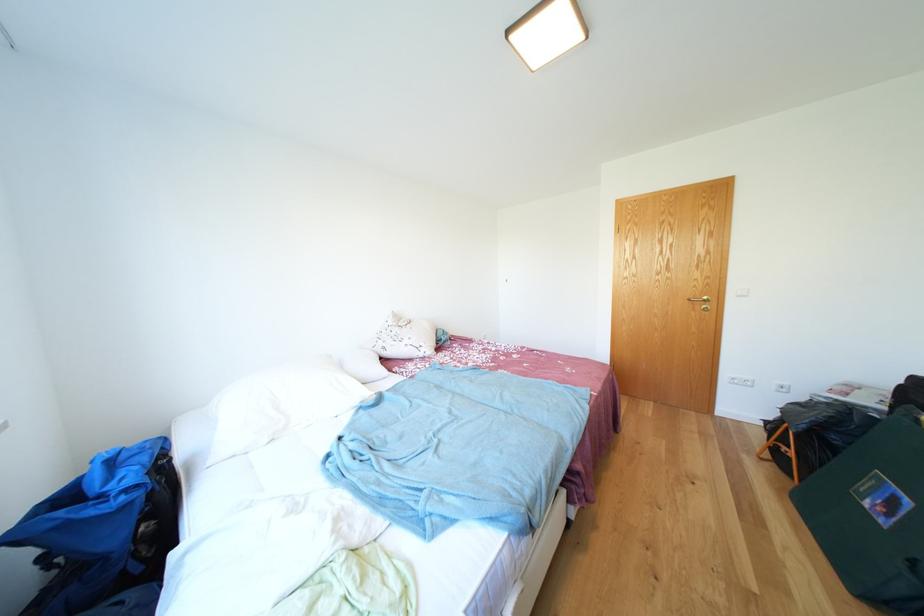
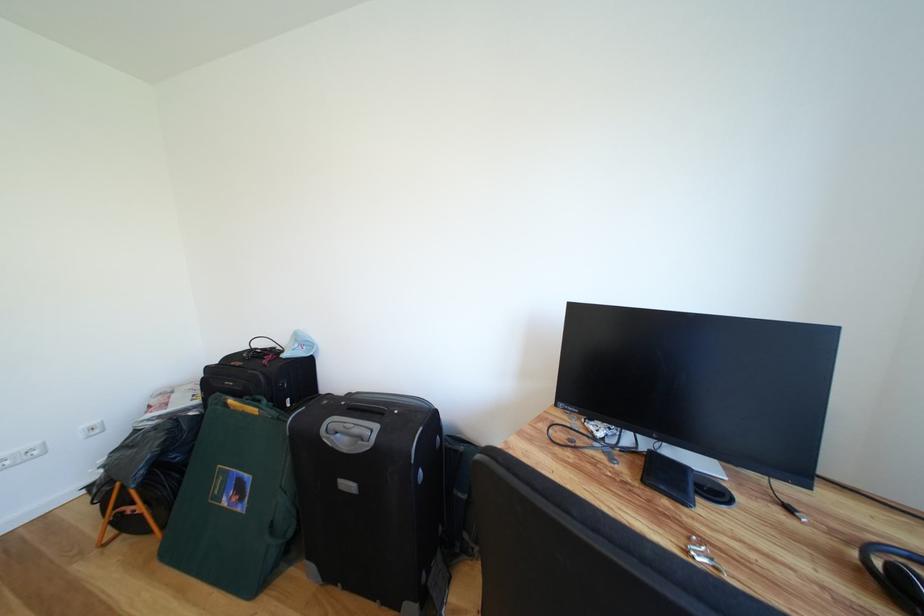
Question: The images are taken continuously from a first-person perspective. In which direction is your viewpoint rotating?

Choices:
 (A) Left
 (B) Right
 (C) Up
 (D) Down

Answer: (B)